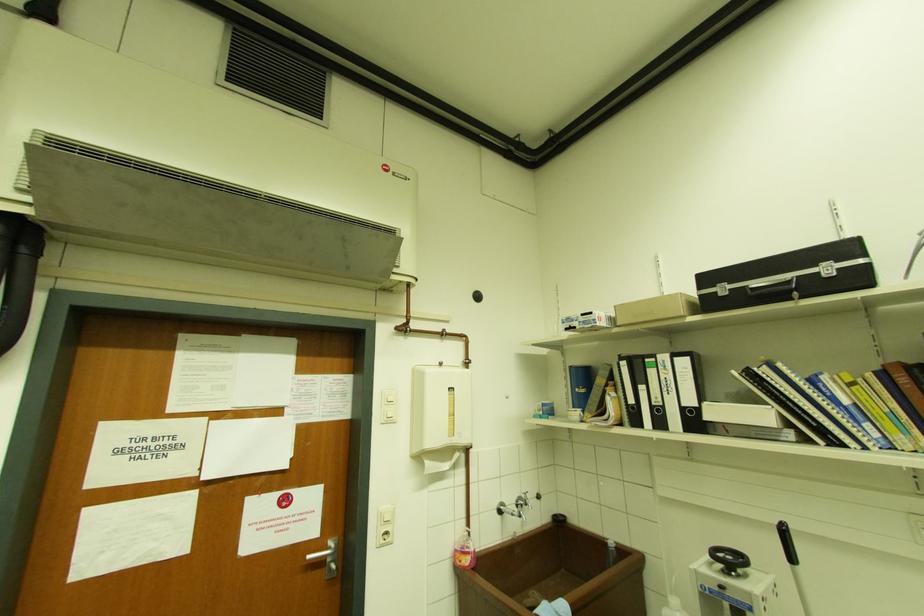
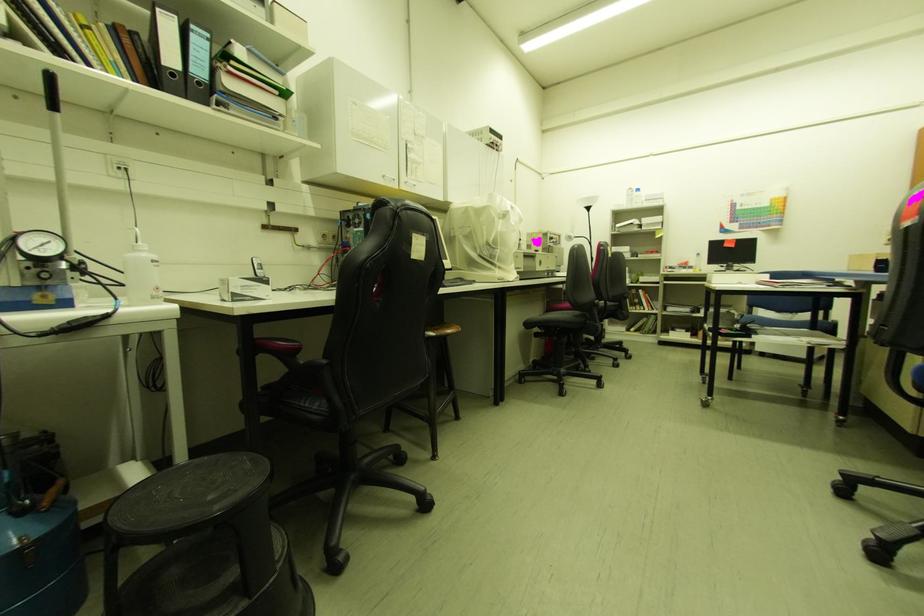
Question: Based on the continuous images, in which direction is the camera rotating? Reply with the corresponding letter.

Choices:
 (A) Left
 (B) Right
 (C) Up
 (D) Down

Answer: (B)